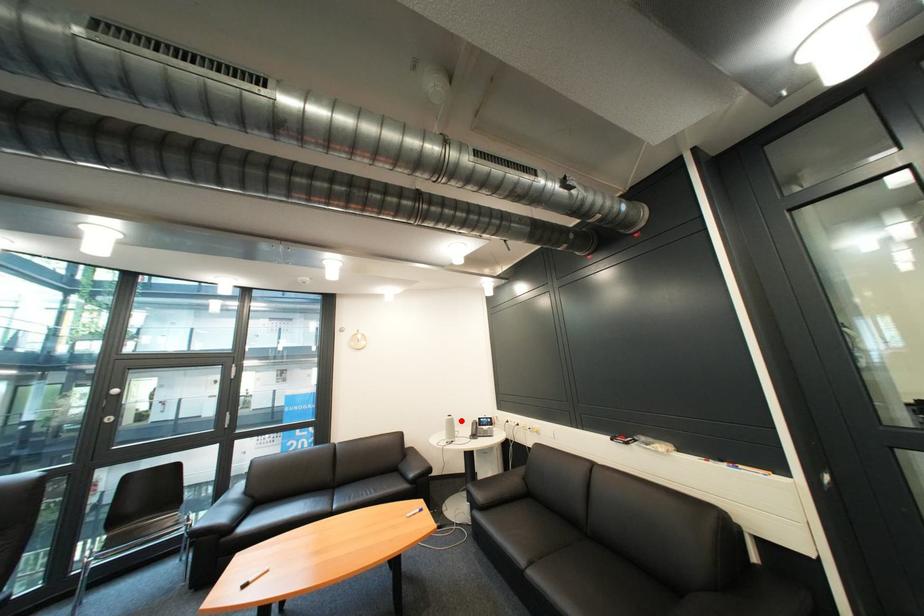
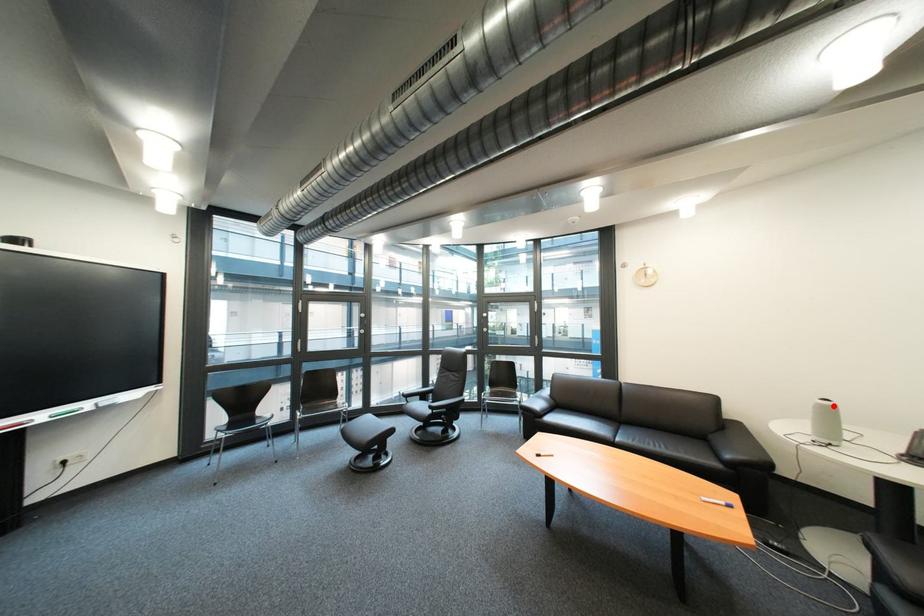
I am providing you with two images of the same scene from different viewpoints. A red point is marked on the first image and another point is marked on the second image. Do the highlighted points in image1 and image2 indicate the same real-world spot?

Yes